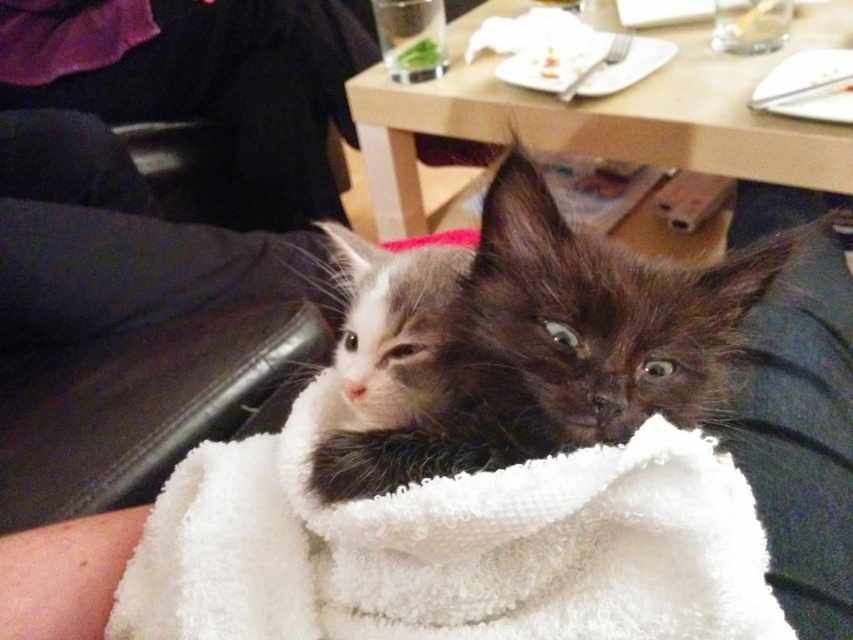
You are a cat owner who wants to place a new toy between the white fluffy blanket at center and the fluffy brown kitten at center. The toy is 3 inches long. Can you fit the toy between them without moving either object?

The distance between the white fluffy blanket at center and the fluffy brown kitten at center is 2.88 inches. Since the toy is 3 inches long, it cannot fit between them without moving either object.

Consider the image. You are trying to place a small toy on the white fluffy blanket at center. If you want to place it exactly at the center of the blanket, where should you place it relative to the kittens?

The white fluffy blanket at center is positioned at point (451, 547). To place the toy exactly at its center, you should position it at the coordinates (451, 547) relative to the kittens.

You are a photographer trying to capture a closeup of the fluffy brown kitten at center. There is a white fluffy blanket at center in the way. Can you move the blanket to the right to get a clear shot?

The white fluffy blanket at center is on the left side of the fluffy brown kitten at center, so moving it to the right would allow you to get a clear shot of the fluffy brown kitten at center without obstruction.